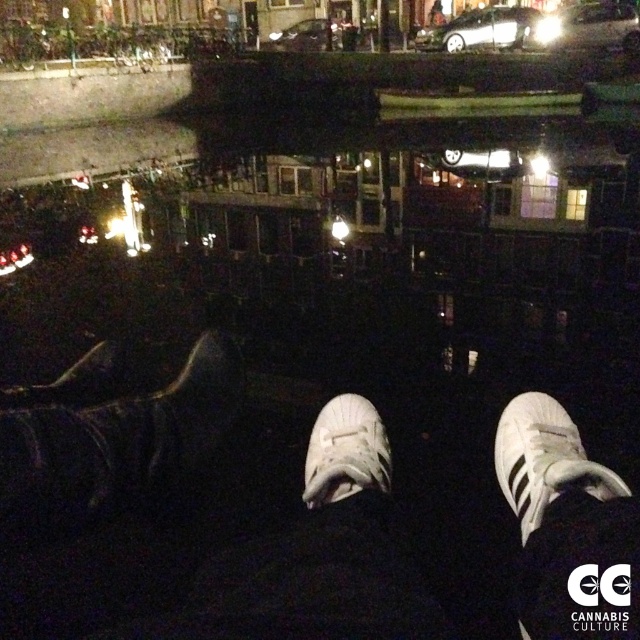
Question: Is shiny silver car at upper right positioned in front of silver metallic car at upper center?

Choices:
 (A) no
 (B) yes

Answer: (B)

Question: Based on their relative distances, which object is nearer to the shiny silver car at upper center?

Choices:
 (A) white synthetic sneakers at center
 (B) white matte shoe at center

Answer: (B)

Question: Does white synthetic sneakers at center appear on the left side of white matte shoe at center?

Choices:
 (A) no
 (B) yes

Answer: (B)

Question: Is the position of white synthetic sneakers at center more distant than that of white matte shoe at center?

Choices:
 (A) yes
 (B) no

Answer: (B)

Question: Based on their relative distances, which object is farther from the shiny silver car at upper right?

Choices:
 (A) white synthetic shoe at center
 (B) shiny silver car at upper center
 (C) white synthetic sneakers at center

Answer: (C)

Question: Which is nearer to the white synthetic shoe at center?

Choices:
 (A) silver metallic car at upper center
 (B) shiny silver car at upper right

Answer: (B)